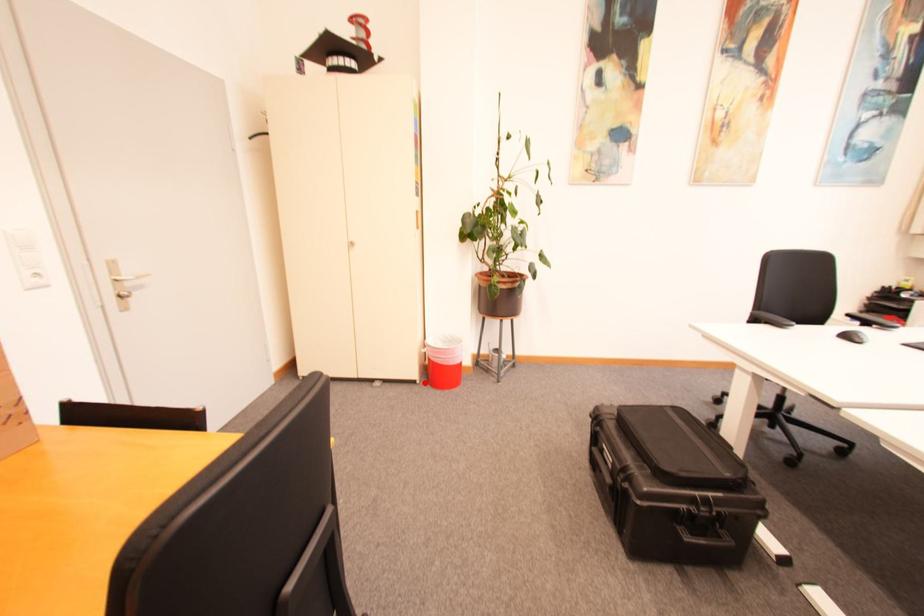
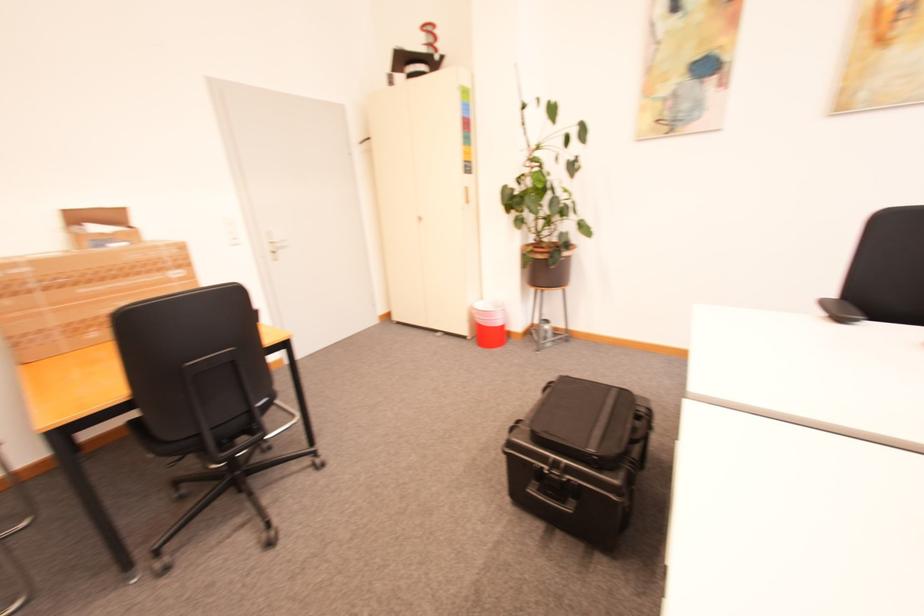
In the second image, find the point that corresponds to the highlighted location in the first image.

(476, 339)